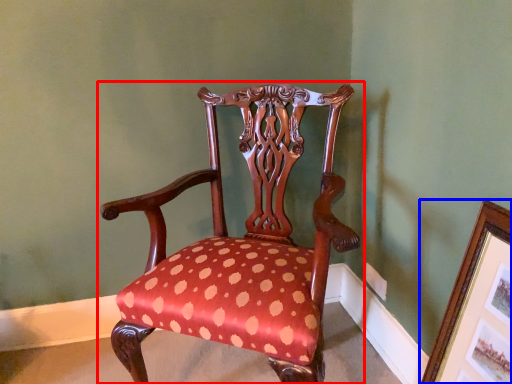
Question: Among these objects, which one is farthest to the camera, chair (highlighted by a red box) or picture frame (highlighted by a blue box)?

Choices:
 (A) chair
 (B) picture frame

Answer: (A)